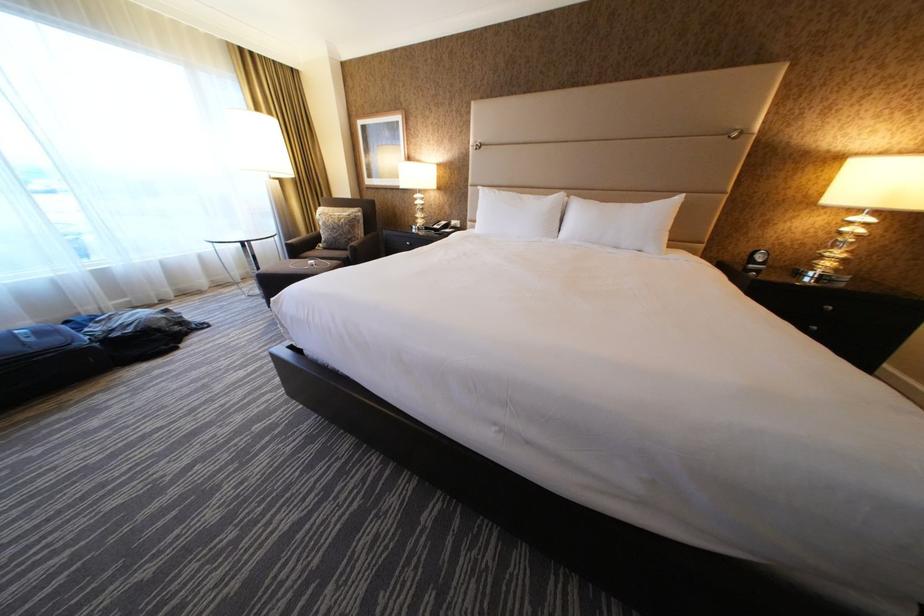
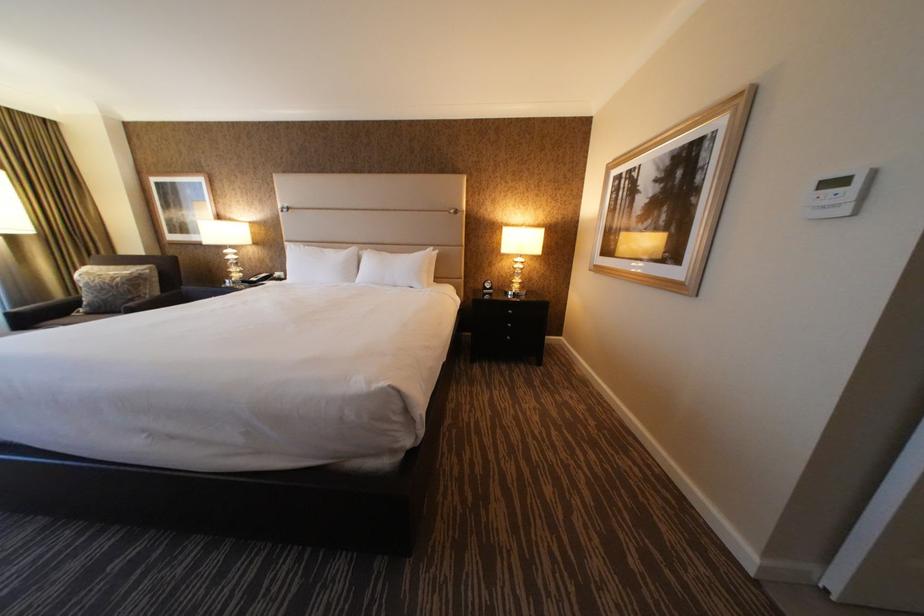
Which direction would the cameraman need to move to produce the second image?

The movement direction of the cameraman is right, backward.